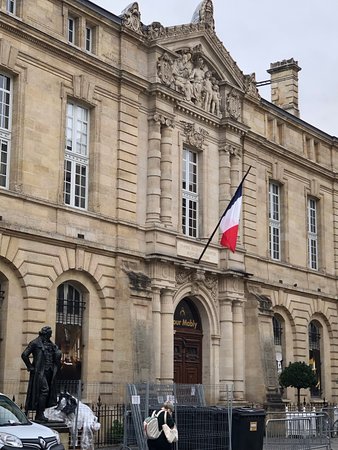
The height and width of the screenshot is (450, 338). I want to click on trash bin, so click(x=253, y=423).